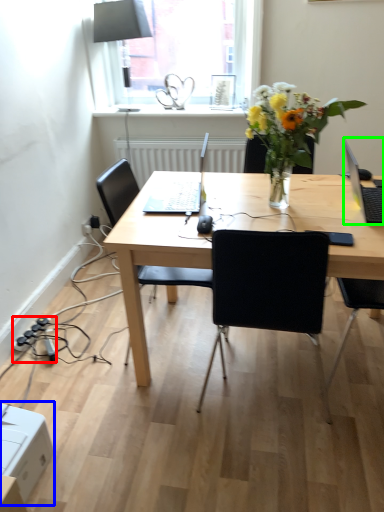
Question: Which is nearer to the power plugs and sockets (highlighted by a red box)? cardboard box (highlighted by a blue box) or laptop (highlighted by a green box).

Choices:
 (A) cardboard box
 (B) laptop

Answer: (A)